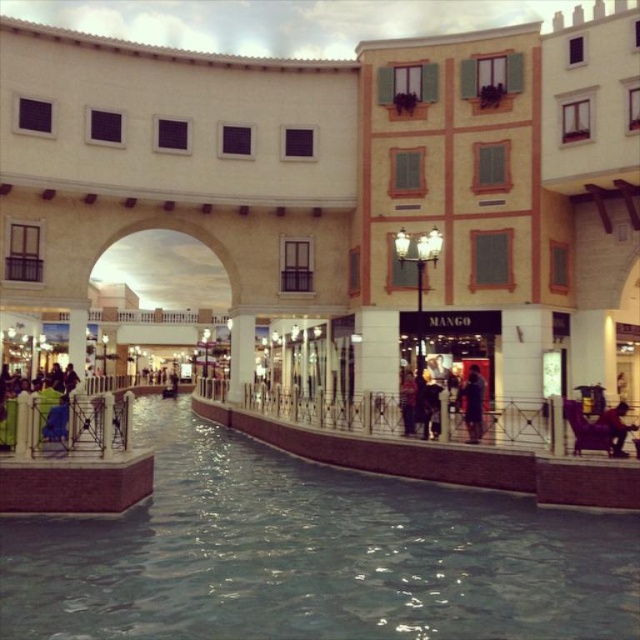
Question: Among these points, which one is nearest to the camera?

Choices:
 (A) (358, 531)
 (B) (616, 444)

Answer: (A)

Question: Among these objects, which one is farthest from the camera?

Choices:
 (A) dark brown leather jacket at lower right
 (B) clear water at center

Answer: (A)

Question: Is clear water at center above dark brown leather jacket at lower right?

Choices:
 (A) yes
 (B) no

Answer: (B)

Question: Which of the following is the farthest from the observer?

Choices:
 (A) dark blue jeans at center
 (B) dark brown leather jacket at lower right

Answer: (A)

Question: Is dark blue jeans at center to the left of dark brown leather jacket at lower right from the viewer's perspective?

Choices:
 (A) yes
 (B) no

Answer: (A)

Question: Does clear water at center have a larger size compared to dark brown leather jacket at lower right?

Choices:
 (A) yes
 (B) no

Answer: (A)